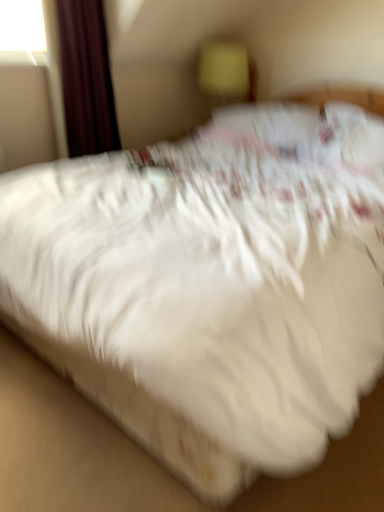
Question: Does dark red velvet curtain at upper left have a lesser height compared to yellow fabric at upper center?

Choices:
 (A) no
 (B) yes

Answer: (A)

Question: Can you confirm if dark red velvet curtain at upper left is thinner than yellow fabric at upper center?

Choices:
 (A) yes
 (B) no

Answer: (A)

Question: Is dark red velvet curtain at upper left in front of yellow fabric at upper center?

Choices:
 (A) yes
 (B) no

Answer: (A)

Question: Does dark red velvet curtain at upper left lie behind yellow fabric at upper center?

Choices:
 (A) no
 (B) yes

Answer: (A)

Question: Is dark red velvet curtain at upper left smaller than yellow fabric at upper center?

Choices:
 (A) no
 (B) yes

Answer: (A)

Question: From the image's perspective, is dark red velvet curtain at upper left located beneath yellow fabric at upper center?

Choices:
 (A) no
 (B) yes

Answer: (B)

Question: From the image's perspective, is yellow fabric at upper center located above dark red velvet curtain at upper left?

Choices:
 (A) no
 (B) yes

Answer: (B)

Question: Is yellow fabric at upper center turned away from dark red velvet curtain at upper left?

Choices:
 (A) yes
 (B) no

Answer: (B)

Question: Does yellow fabric at upper center have a smaller size compared to dark red velvet curtain at upper left?

Choices:
 (A) yes
 (B) no

Answer: (A)

Question: Is the depth of yellow fabric at upper center greater than that of dark red velvet curtain at upper left?

Choices:
 (A) yes
 (B) no

Answer: (A)

Question: Considering the relative sizes of yellow fabric at upper center and dark red velvet curtain at upper left in the image provided, is yellow fabric at upper center wider than dark red velvet curtain at upper left?

Choices:
 (A) yes
 (B) no

Answer: (A)

Question: Can you confirm if yellow fabric at upper center is positioned to the left of dark red velvet curtain at upper left?

Choices:
 (A) no
 (B) yes

Answer: (A)

Question: Is yellow fabric at upper center inside the boundaries of dark red velvet curtain at upper left, or outside?

Choices:
 (A) inside
 (B) outside

Answer: (B)